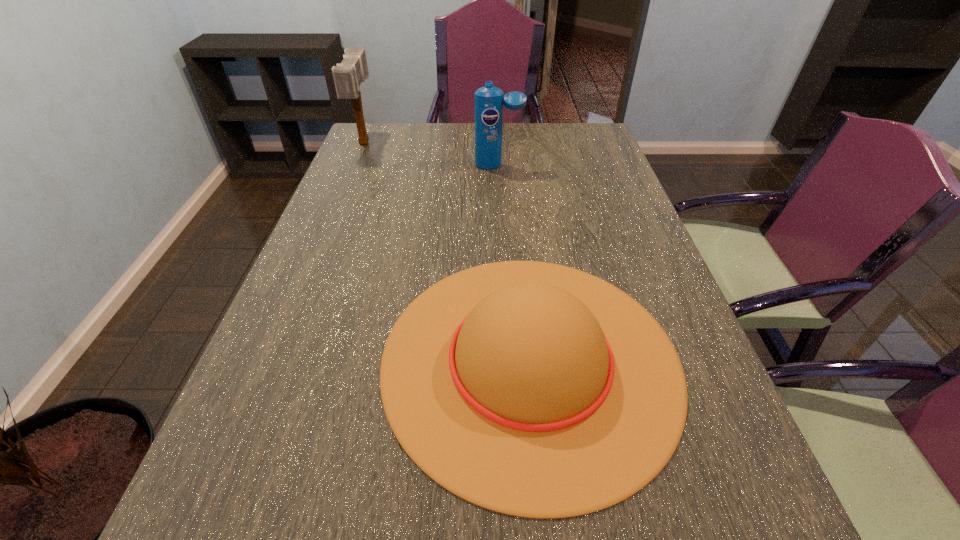
At what (x,y) coordinates should I click in order to perform the action: click on the farthest object. Please return your answer as a coordinate pair (x, y). The image size is (960, 540). Looking at the image, I should click on point(348,75).

Where is `the leftmost object`? Image resolution: width=960 pixels, height=540 pixels. the leftmost object is located at coordinates (348, 75).

Locate an element on the screen. This screenshot has width=960, height=540. the second farthest object is located at coordinates (489, 102).

What are the coordinates of `sombrero` in the screenshot? It's located at (532, 389).

This screenshot has width=960, height=540. What are the coordinates of `the nearest object` in the screenshot? It's located at (532, 389).

Where is `vacant space located on the right of the farthest object`? vacant space located on the right of the farthest object is located at coordinates (413, 143).

This screenshot has height=540, width=960. Find the location of `free spot located on the right of the shampoo`. free spot located on the right of the shampoo is located at coordinates (571, 165).

Identify the location of vacant space located 0.240m on the left of the shortest object. (260, 359).

Locate an element on the screen. This screenshot has height=540, width=960. object present at the far edge is located at coordinates (348, 75).

Locate an element on the screen. The image size is (960, 540). object at the left edge is located at coordinates (348, 75).